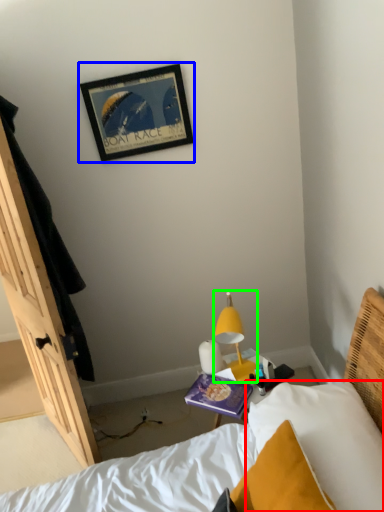
Question: Considering the real-world distances, which object is farthest from pillow (highlighted by a red box)? picture frame (highlighted by a blue box) or lamp (highlighted by a green box)?

Choices:
 (A) picture frame
 (B) lamp

Answer: (A)